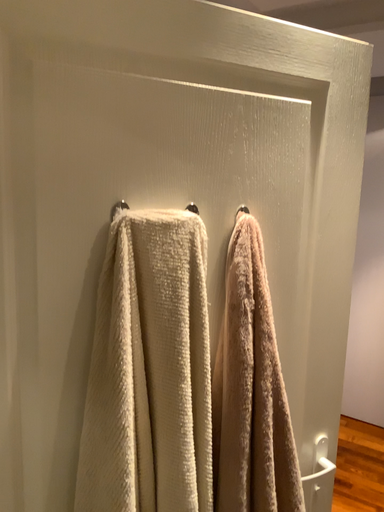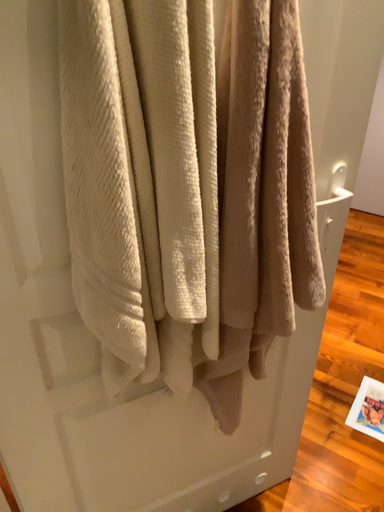
Question: How did the camera likely rotate when shooting the video?

Choices:
 (A) rotated downward
 (B) rotated upward

Answer: (A)